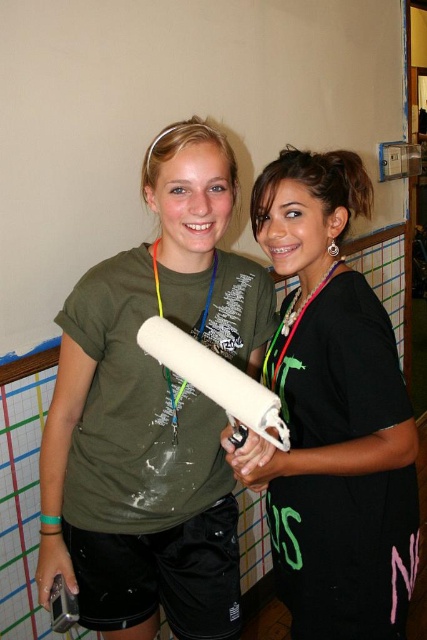
Question: Among these objects, which one is farthest from the camera?

Choices:
 (A) matte green t-shirt at center
 (B) neon green fabric lanyard at center
 (C) neon plastic lanyard at center

Answer: (B)

Question: Observing the image, what is the correct spatial positioning of black matte shirt at center in reference to white matte paint roller at center?

Choices:
 (A) below
 (B) above

Answer: (A)

Question: Can you confirm if matte green t-shirt at center is positioned above neon plastic lanyard at center?

Choices:
 (A) no
 (B) yes

Answer: (A)

Question: Among these objects, which one is nearest to the camera?

Choices:
 (A) neon green fabric lanyard at center
 (B) matte green t-shirt at center

Answer: (B)

Question: Based on their relative distances, which object is nearer to the black matte shirt at center?

Choices:
 (A) neon plastic lanyard at center
 (B) matte green t-shirt at center
 (C) white matte paint roller at center

Answer: (B)

Question: Is black matte shirt at center closer to camera compared to white matte paint roller at center?

Choices:
 (A) yes
 (B) no

Answer: (B)